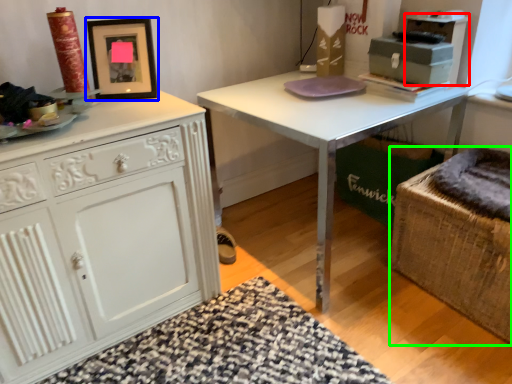
Question: Considering the real-world distances, which object is farthest from cabinetry (highlighted by a red box)? picture frame (highlighted by a blue box) or swivel chair (highlighted by a green box)?

Choices:
 (A) picture frame
 (B) swivel chair

Answer: (A)